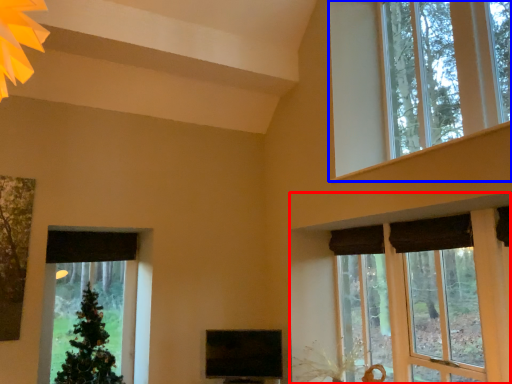
Question: Which point is closer to the camera, window (highlighted by a red box) or window (highlighted by a blue box)?

Choices:
 (A) window
 (B) window

Answer: (A)